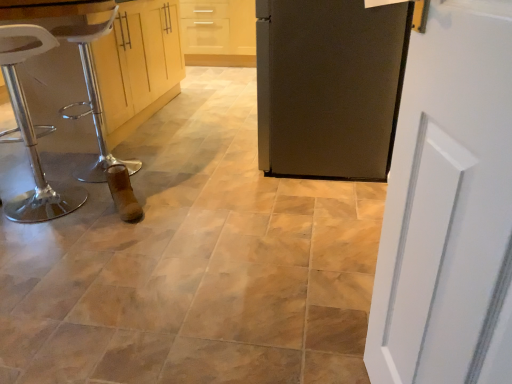
Image resolution: width=512 pixels, height=384 pixels. What are the coordinates of `vacant area that lies in front of matte black refrigerator at center, marked as the first door in a right-to-left arrangement` in the screenshot? It's located at coord(298,208).